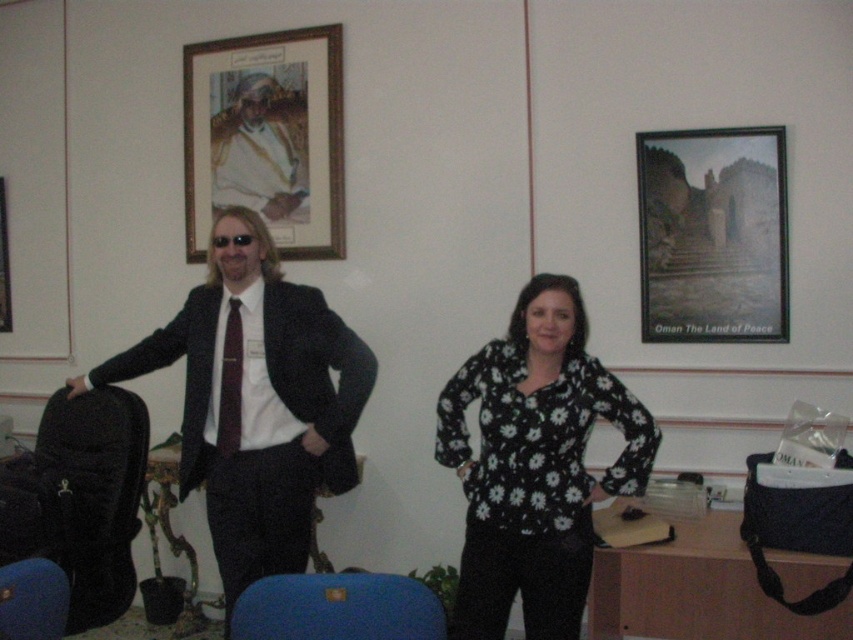
Is wooden frame at upper center closer to the viewer compared to dark red satin tie at left?

No, it is behind dark red satin tie at left.

Which is behind, point (213, 67) or point (218, 436)?

The point (213, 67) is behind.

Which is in front, point (199, 54) or point (235, 323)?

Point (235, 323)

Where is `wooden frame at upper center`? Image resolution: width=853 pixels, height=640 pixels. wooden frame at upper center is located at coordinates (267, 136).

Does matte black suit at center appear under black floral blouse at center?

No.

Does point (573, 328) come closer to viewer compared to point (523, 522)?

No.

Is point (224, 221) farther from viewer compared to point (502, 436)?

Yes, it is behind point (502, 436).

At what (x,y) coordinates should I click in order to perform the action: click on matte black suit at center. Please return your answer as a coordinate pair (x, y). Looking at the image, I should click on (257, 404).

Is black satin suit at left above matte black frame at upper right?

No, black satin suit at left is not above matte black frame at upper right.

Is point (252, 445) closer to camera compared to point (688, 276)?

Yes, point (252, 445) is in front of point (688, 276).

Locate an element on the screen. The width and height of the screenshot is (853, 640). black satin suit at left is located at coordinates point(259,404).